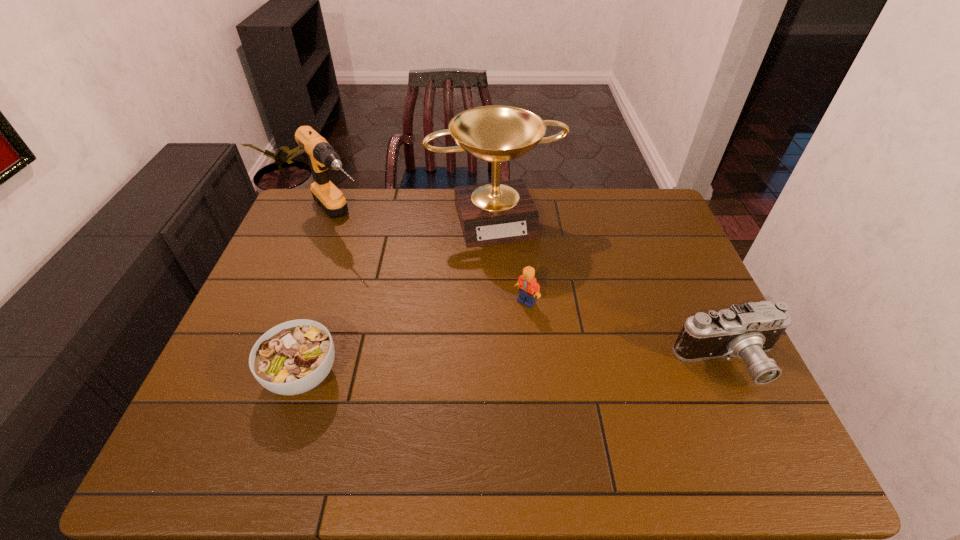
You are a GUI agent. You are given a task and a screenshot of the screen. Output one action in this format:
    pyautogui.click(x=<x>, y=<y>)
    Task: Click on the vacant spot on the desktop that is between the soup bowl and the rightmost object and is positioned on the front-facing side of the award
    
    Given the screenshot: What is the action you would take?
    [x=550, y=367]

Image resolution: width=960 pixels, height=540 pixels. In order to click on free space on the desktop that is between the soup bowl and the rightmost object and is positioned at the tip of the drill in this screenshot , I will do pyautogui.click(x=484, y=369).

The width and height of the screenshot is (960, 540). Identify the location of vacant space on the desktop that is between the soup bowl and the camera and is positioned on the front-facing side of the Lego. (502, 369).